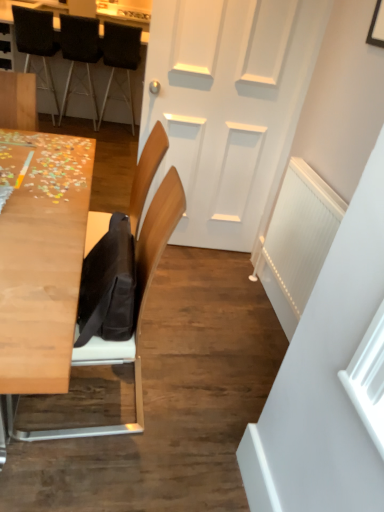
At what (x,y) coordinates should I click in order to perform the action: click on free point to the right of wooden chair at left, which is counted as the 1th chair, starting from the front. Please return your answer as a coordinate pair (x, y). The height and width of the screenshot is (512, 384). Looking at the image, I should click on (197, 408).